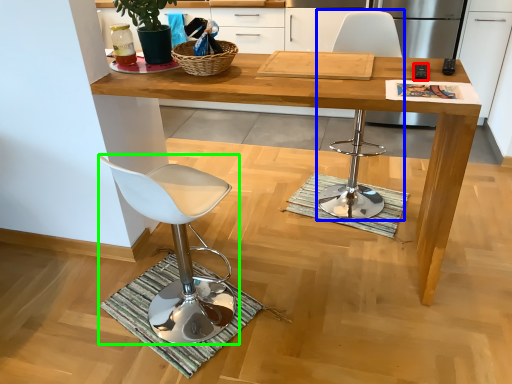
Question: Which object is positioned farthest from remote control (highlighted by a red box)? Select from chair (highlighted by a blue box) and chair (highlighted by a green box).

Choices:
 (A) chair
 (B) chair

Answer: (B)